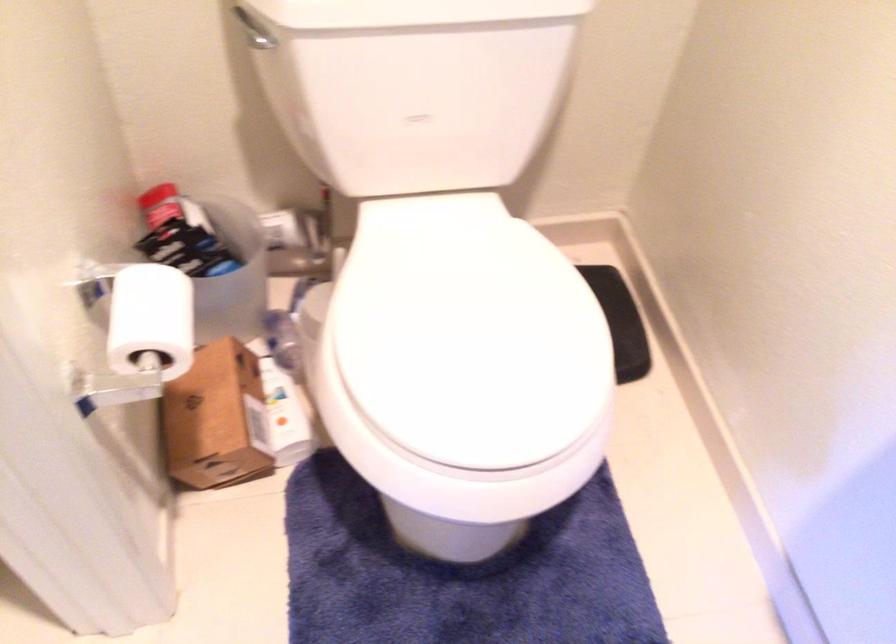
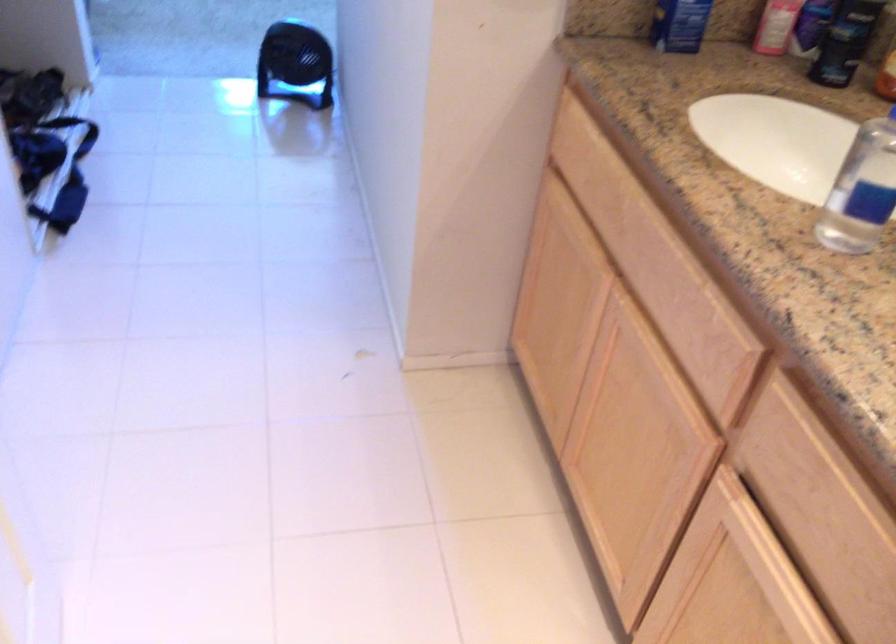
The first image is from the beginning of the video and the second image is from the end. How did the camera likely rotate when shooting the video?

The camera's rotation is toward left-down.